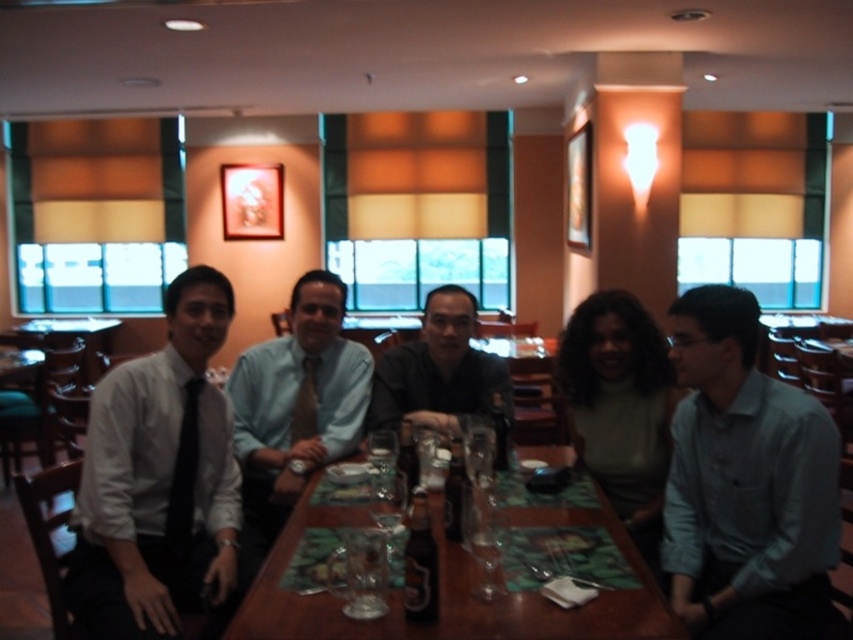
Question: Is light blue shirt at center closer to camera compared to brown silk tie at center?

Choices:
 (A) yes
 (B) no

Answer: (A)

Question: Which of these objects is positioned farthest from the black silk tie at left?

Choices:
 (A) wooden table at center
 (B) matte beige sweater at center
 (C) white shirt at left

Answer: (B)

Question: Is the position of light blue shirt at center more distant than that of matte gray shirt at center?

Choices:
 (A) yes
 (B) no

Answer: (B)

Question: Which of the following is the farthest from the observer?

Choices:
 (A) (711, 620)
 (B) (567, 506)

Answer: (B)

Question: Among these points, which one is farthest from the camera?

Choices:
 (A) (306, 410)
 (B) (219, 580)
 (C) (450, 573)

Answer: (A)

Question: Observing the image, what is the correct spatial positioning of wooden table at center in reference to black silk tie at left?

Choices:
 (A) above
 (B) below

Answer: (B)